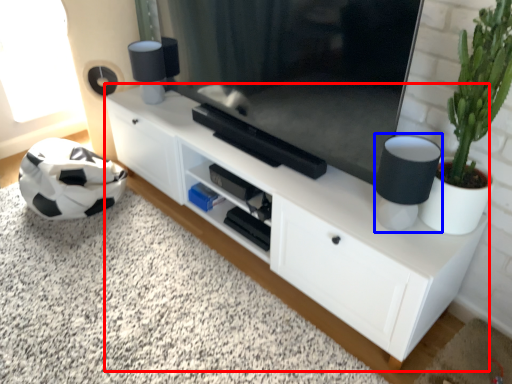
Question: Which object appears closest to the camera in this image, cabinetry (highlighted by a red box) or lamp (highlighted by a blue box)?

Choices:
 (A) cabinetry
 (B) lamp

Answer: (B)